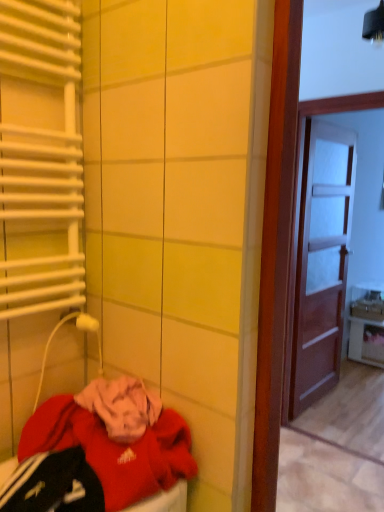
Question: From a real-world perspective, is white glossy cabinet at right beneath white metallic radiator at left?

Choices:
 (A) no
 (B) yes

Answer: (B)

Question: Considering the relative sizes of white glossy cabinet at right and white metallic radiator at left in the image provided, is white glossy cabinet at right taller than white metallic radiator at left?

Choices:
 (A) no
 (B) yes

Answer: (A)

Question: Considering the relative sizes of white glossy cabinet at right and white metallic radiator at left in the image provided, is white glossy cabinet at right shorter than white metallic radiator at left?

Choices:
 (A) no
 (B) yes

Answer: (B)

Question: Does white glossy cabinet at right come behind white metallic radiator at left?

Choices:
 (A) no
 (B) yes

Answer: (B)

Question: Is white metallic radiator at left inside white glossy cabinet at right?

Choices:
 (A) no
 (B) yes

Answer: (A)

Question: From a real-world perspective, relative to white glossy cabinet at right, is brown wooden door at right vertically above or below?

Choices:
 (A) below
 (B) above

Answer: (B)

Question: From the image's perspective, relative to white glossy cabinet at right, is brown wooden door at right above or below?

Choices:
 (A) above
 (B) below

Answer: (A)

Question: In terms of size, does brown wooden door at right appear bigger or smaller than white glossy cabinet at right?

Choices:
 (A) small
 (B) big

Answer: (B)

Question: Is brown wooden door at right wider or thinner than white glossy cabinet at right?

Choices:
 (A) thin
 (B) wide

Answer: (A)

Question: Considering their positions, is white metallic radiator at left located in front of or behind white glossy cabinet at right?

Choices:
 (A) behind
 (B) front

Answer: (B)

Question: Is white metallic radiator at left spatially inside white glossy cabinet at right, or outside of it?

Choices:
 (A) inside
 (B) outside

Answer: (B)

Question: Is white metallic radiator at left bigger or smaller than white glossy cabinet at right?

Choices:
 (A) big
 (B) small

Answer: (B)

Question: Considering the positions of white metallic radiator at left and white glossy cabinet at right in the image, is white metallic radiator at left wider or thinner than white glossy cabinet at right?

Choices:
 (A) wide
 (B) thin

Answer: (B)

Question: From the image's perspective, is white glossy cabinet at right located above or below red fleece sweatshirt at lower left?

Choices:
 (A) below
 (B) above

Answer: (A)

Question: Is white glossy cabinet at right situated inside red fleece sweatshirt at lower left or outside?

Choices:
 (A) inside
 (B) outside

Answer: (B)